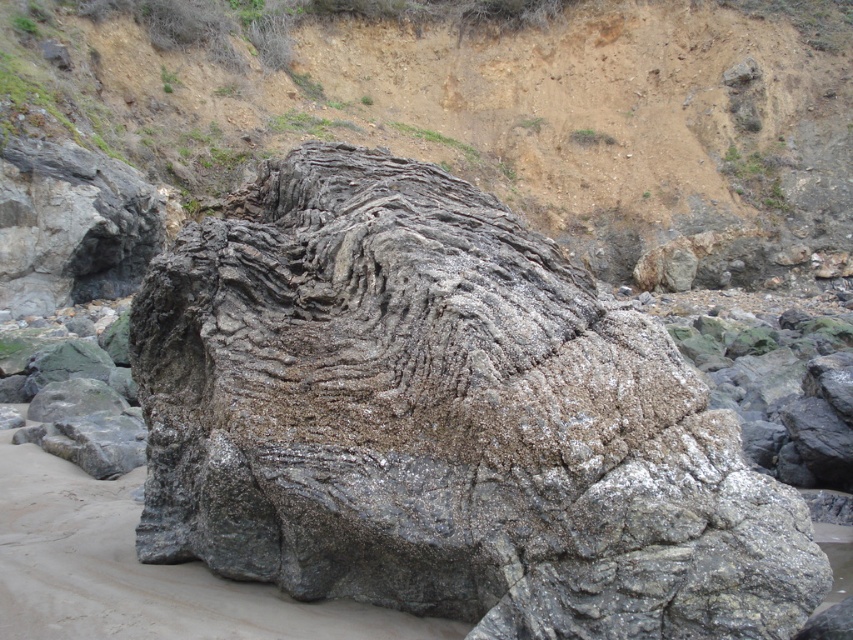
You are a geologist examining the rock formations on the beach. You have two rocks to compare in front of you, the gray rough rock at center and the dull brown rock at center. Which one do you think is smaller in size?

The gray rough rock at center is smaller in size compared to the dull brown rock at center according to the description.